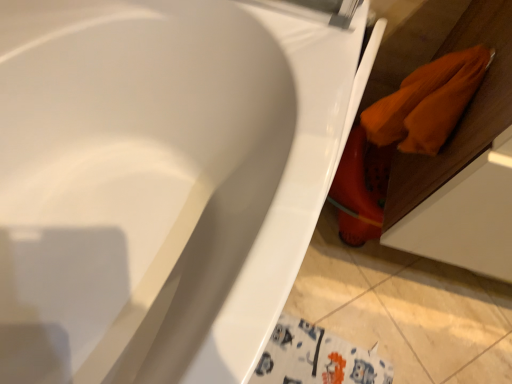
This screenshot has height=384, width=512. What do you see at coordinates (375, 334) in the screenshot?
I see `white fabric at lower center` at bounding box center [375, 334].

Locate an element on the screen. This screenshot has height=384, width=512. white fabric at lower center is located at coordinates (375, 334).

The height and width of the screenshot is (384, 512). In order to click on white fabric at lower center in this screenshot , I will do `click(375, 334)`.